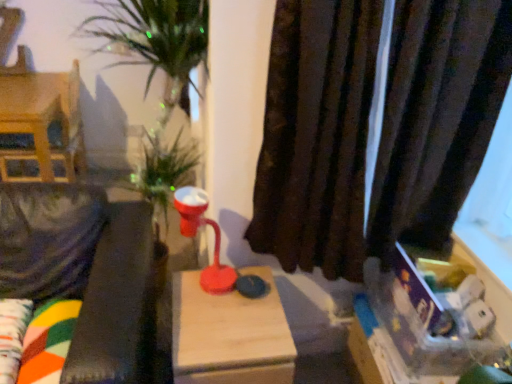
Measure the distance between wooden dollhouse at left and camera.

2.19 meters.

Where is `brown velvet curtain at right`? The width and height of the screenshot is (512, 384). brown velvet curtain at right is located at coordinates (316, 136).

Identify the location of velvet green couch at left. Image resolution: width=512 pixels, height=384 pixels. (80, 269).

This screenshot has height=384, width=512. I want to click on wooden table at center, so click(x=230, y=334).

At what (x,y) coordinates should I click in order to perform the action: click on matte plastic table lamp at center. Please return your answer as a coordinate pair (x, y). This screenshot has height=384, width=512. Looking at the image, I should click on (196, 233).

Are velvet green couch at left and matte plastic table lamp at center beside each other?

No, velvet green couch at left is not with matte plastic table lamp at center.

From a real-world perspective, is velvet green couch at left below matte plastic table lamp at center?

Yes.

Can you confirm if velvet green couch at left is shorter than matte plastic table lamp at center?

No, velvet green couch at left is not shorter than matte plastic table lamp at center.

From a real-world perspective, is wooden table at center on top of matte plastic table lamp at center?

Actually, wooden table at center is physically below matte plastic table lamp at center in the real world.

Measure the distance between wooden table at center and matte plastic table lamp at center.

wooden table at center and matte plastic table lamp at center are 7.11 inches apart.

From the image's perspective, would you say wooden table at center is positioned over matte plastic table lamp at center?

No, from the image's perspective, wooden table at center is not on top of matte plastic table lamp at center.

Looking at this image, from a real-world perspective, is velvet green couch at left on top of wooden dollhouse at left?

Actually, velvet green couch at left is physically below wooden dollhouse at left in the real world.

Does velvet green couch at left turn towards wooden dollhouse at left?

No, velvet green couch at left does not turn towards wooden dollhouse at left.

From the image's perspective, which one is positioned lower, velvet green couch at left or wooden dollhouse at left?

velvet green couch at left, from the image's perspective.

Measure the distance between velvet green couch at left and wooden dollhouse at left.

velvet green couch at left and wooden dollhouse at left are 1.18 meters apart from each other.

In the scene shown: Considering the sizes of objects velvet green couch at left and brown velvet curtain at right in the image provided, who is smaller, velvet green couch at left or brown velvet curtain at right?

brown velvet curtain at right is smaller.

From a real-world perspective, is velvet green couch at left below brown velvet curtain at right?

Yes, from a real-world perspective, velvet green couch at left is below brown velvet curtain at right.

From the picture: In terms of height, does brown velvet curtain at right look taller or shorter compared to velvet green couch at left?

Considering their sizes, brown velvet curtain at right has more height than velvet green couch at left.

Consider the image. Is brown velvet curtain at right in front of velvet green couch at left?

That is False.

Which of these two, brown velvet curtain at right or velvet green couch at left, is bigger?

velvet green couch at left is bigger.

Is brown velvet curtain at right thinner than wooden dollhouse at left?

Yes.

Based on the photo, in terms of size, does brown velvet curtain at right appear bigger or smaller than wooden dollhouse at left?

Answer: Clearly, brown velvet curtain at right is smaller in size than wooden dollhouse at left.

Does point (414, 129) appear closer or farther from the camera than point (15, 80)?

Point (414, 129) appears to be closer to the viewer than point (15, 80).

Looking at this image, is brown velvet curtain at right directly adjacent to wooden table at center?

No, brown velvet curtain at right is not next to wooden table at center.

From a real-world perspective, between brown velvet curtain at right and wooden table at center, who is vertically lower?

wooden table at center, from a real-world perspective.

Is point (350, 237) closer or farther from the camera than point (287, 382)?

Clearly, point (350, 237) is more distant from the camera than point (287, 382).

Can we say brown velvet curtain at right lies outside wooden table at center?

Yes, brown velvet curtain at right is outside of wooden table at center.

Find the location of `couch on the left of matte plastic table lamp at center`. couch on the left of matte plastic table lamp at center is located at coordinates (80, 269).

At what (x,y) coordinates should I click in order to perform the action: click on table below the matte plastic table lamp at center (from the image's perspective). Please return your answer as a coordinate pair (x, y). Looking at the image, I should click on (230, 334).

Looking at the image, which one is located closer to brown velvet curtain at right, wooden dollhouse at left or velvet green couch at left?

Based on the image, velvet green couch at left appears to be nearer to brown velvet curtain at right.

Based on their spatial positions, is wooden dollhouse at left or matte plastic table lamp at center closer to velvet green couch at left?

Based on the image, matte plastic table lamp at center appears to be nearer to velvet green couch at left.

Which object lies further to the anchor point wooden table at center, brown velvet curtain at right or wooden dollhouse at left?

The object further to wooden table at center is wooden dollhouse at left.

Based on their spatial positions, is brown velvet curtain at right or velvet green couch at left further from matte plastic table lamp at center?

brown velvet curtain at right is positioned further to the anchor matte plastic table lamp at center.

When comparing their distances from velvet green couch at left, does brown velvet curtain at right or matte plastic table lamp at center seem closer?

Among the two, matte plastic table lamp at center is located nearer to velvet green couch at left.

Estimate the real-world distances between objects in this image. Which object is closer to wooden dollhouse at left, brown velvet curtain at right or matte plastic table lamp at center?

matte plastic table lamp at center is positioned closer to the anchor wooden dollhouse at left.

Considering their positions, is velvet green couch at left positioned further to wooden table at center than wooden dollhouse at left?

The object further to wooden table at center is wooden dollhouse at left.

From the image, which object appears to be nearer to matte plastic table lamp at center, wooden dollhouse at left or wooden table at center?

wooden table at center lies closer to matte plastic table lamp at center than the other object.

Identify the location of table lamp between velvet green couch at left and wooden dollhouse at left from front to back. Image resolution: width=512 pixels, height=384 pixels. (196, 233).

Image resolution: width=512 pixels, height=384 pixels. Identify the location of table lamp between wooden dollhouse at left and wooden table at center. point(196,233).

I want to click on table between velvet green couch at left and wooden dollhouse at left from front to back, so click(x=230, y=334).

Where is `table lamp situated between wooden dollhouse at left and brown velvet curtain at right from left to right`? This screenshot has height=384, width=512. table lamp situated between wooden dollhouse at left and brown velvet curtain at right from left to right is located at coordinates (196, 233).